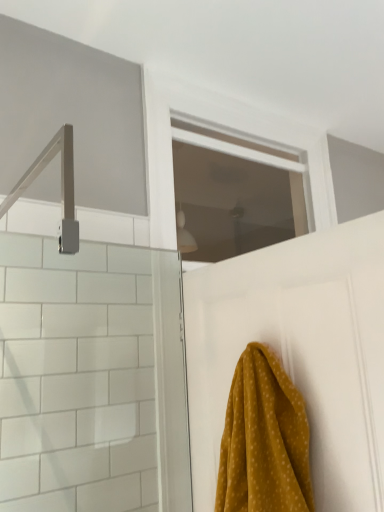
Question: Is transparent glass window at center facing towards mustard yellow fabric at lower right?

Choices:
 (A) no
 (B) yes

Answer: (A)

Question: Is mustard yellow fabric at lower right a part of transparent glass window at center?

Choices:
 (A) no
 (B) yes

Answer: (A)

Question: Can you confirm if transparent glass window at center is bigger than mustard yellow fabric at lower right?

Choices:
 (A) yes
 (B) no

Answer: (A)

Question: Is transparent glass window at center not close to mustard yellow fabric at lower right?

Choices:
 (A) no
 (B) yes

Answer: (B)

Question: Is transparent glass window at center in contact with mustard yellow fabric at lower right?

Choices:
 (A) no
 (B) yes

Answer: (A)

Question: Is transparent glass window at center behind mustard yellow fabric at lower right?

Choices:
 (A) no
 (B) yes

Answer: (B)

Question: Is mustard yellow fabric at lower right positioned with its back to white matte door at upper center?

Choices:
 (A) no
 (B) yes

Answer: (A)

Question: Is mustard yellow fabric at lower right further to the viewer compared to white matte door at upper center?

Choices:
 (A) no
 (B) yes

Answer: (A)

Question: Considering the relative sizes of mustard yellow fabric at lower right and white matte door at upper center in the image provided, is mustard yellow fabric at lower right bigger than white matte door at upper center?

Choices:
 (A) no
 (B) yes

Answer: (A)

Question: Is white matte door at upper center completely or partially inside mustard yellow fabric at lower right?

Choices:
 (A) no
 (B) yes

Answer: (A)

Question: Are mustard yellow fabric at lower right and white matte door at upper center making contact?

Choices:
 (A) no
 (B) yes

Answer: (A)

Question: Is mustard yellow fabric at lower right positioned beyond the bounds of white matte door at upper center?

Choices:
 (A) yes
 (B) no

Answer: (A)

Question: Is white matte door at upper center placed right next to transparent glass window at center?

Choices:
 (A) yes
 (B) no

Answer: (B)